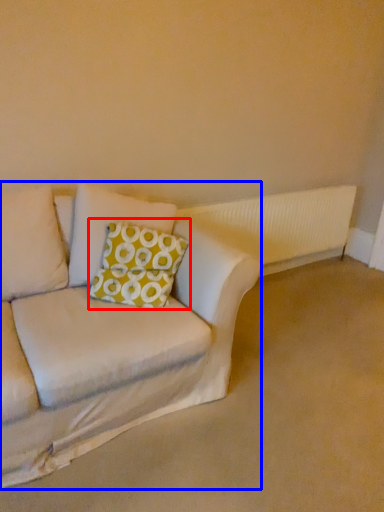
Question: Among these objects, which one is farthest to the camera, throw pillow (highlighted by a red box) or studio couch (highlighted by a blue box)?

Choices:
 (A) throw pillow
 (B) studio couch

Answer: (A)